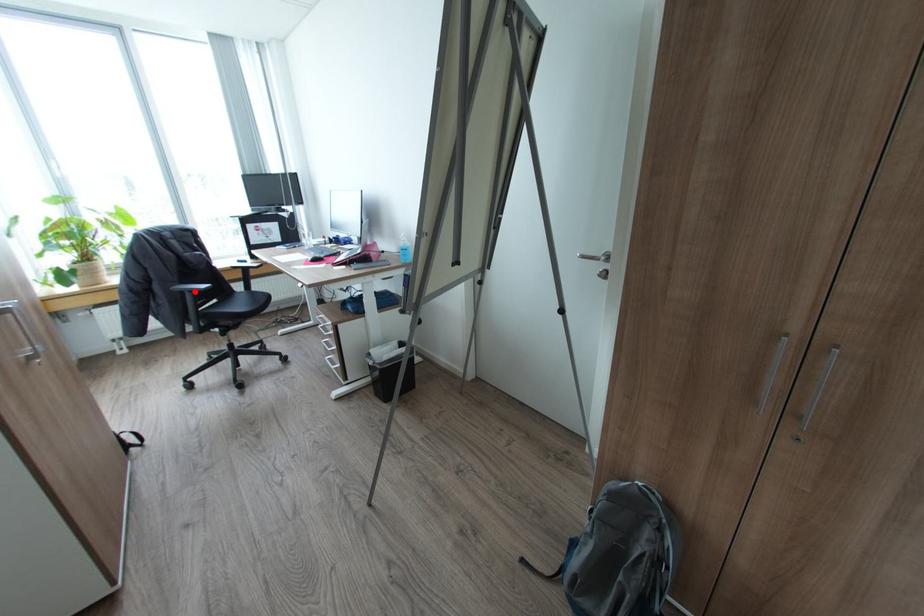
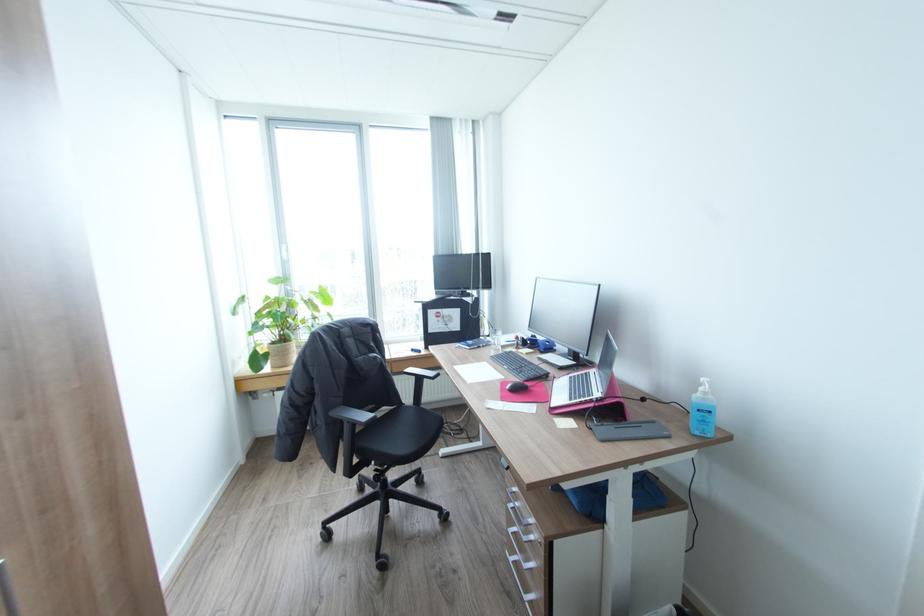
Locate, in the second image, the point that corresponds to the highlighted location in the first image.

(354, 422)